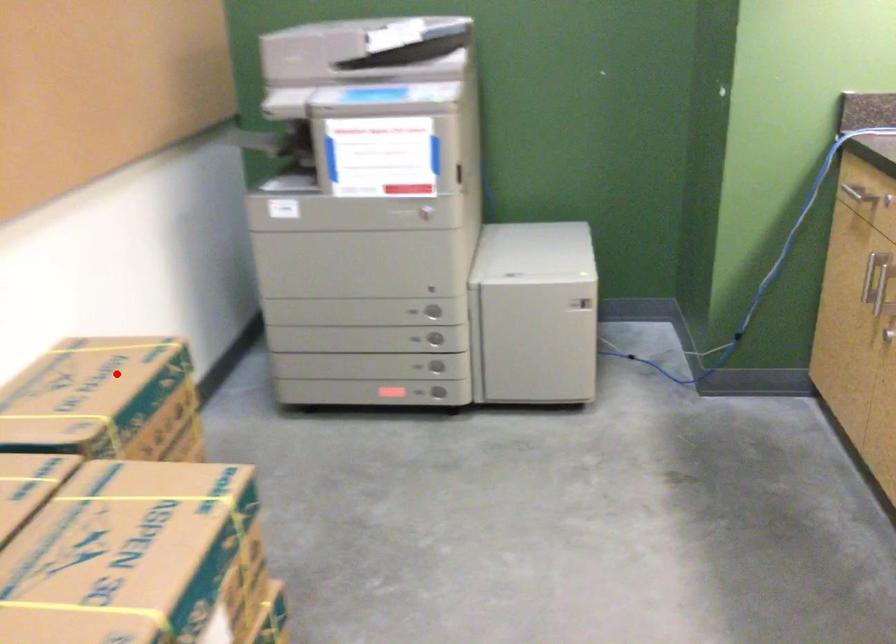
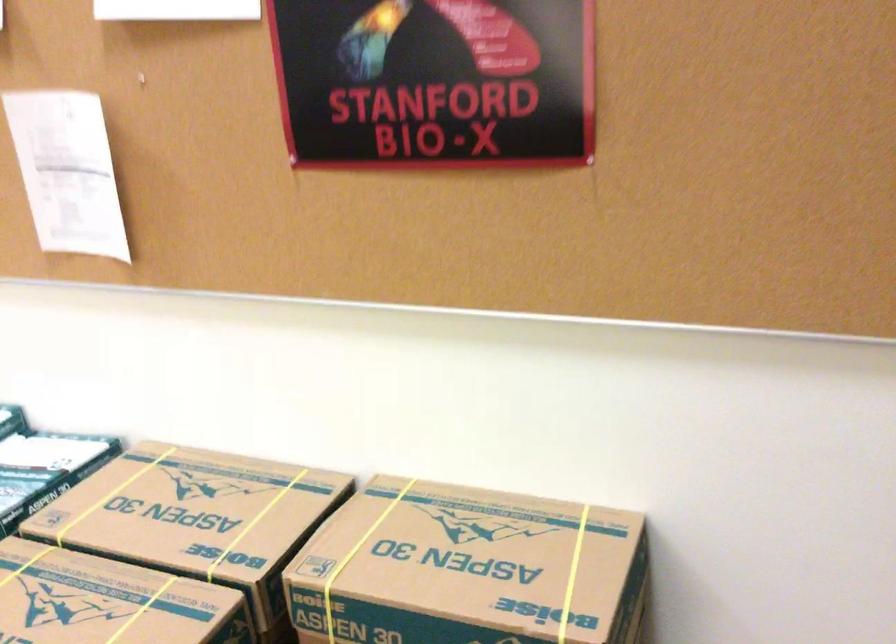
Question: I am providing you with two images of the same scene from different viewpoints. Image1 has a red point marked. In image2, the corresponding 3D location appears at what relative position? Reply with the corresponding letter.

Choices:
 (A) Closer
 (B) Farther

Answer: (A)